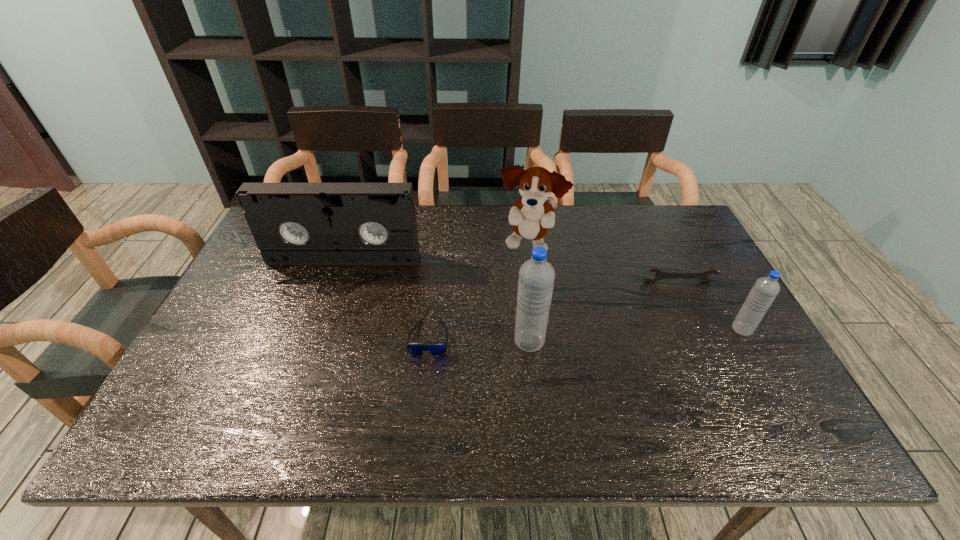
Where is `the taller water bottle`? The image size is (960, 540). the taller water bottle is located at coordinates (536, 279).

In order to click on the right water bottle in this screenshot , I will do `click(765, 289)`.

Where is `the fourth tallest object`? This screenshot has width=960, height=540. the fourth tallest object is located at coordinates (765, 289).

Locate an element on the screen. puppy is located at coordinates [531, 216].

Where is `videotape`? videotape is located at coordinates click(292, 223).

The width and height of the screenshot is (960, 540). I want to click on wrench, so click(x=660, y=274).

I want to click on sunglasses, so click(435, 349).

At what (x,y) coordinates should I click in order to perform the action: click on blank space located on the back of the taller water bottle. Please return your answer as a coordinate pair (x, y). The height and width of the screenshot is (540, 960). Looking at the image, I should click on (518, 238).

I want to click on vacant space located on the back of the shorter water bottle, so click(x=720, y=290).

Locate an element on the screen. blank area located 0.340m on the face of the puppy is located at coordinates (542, 359).